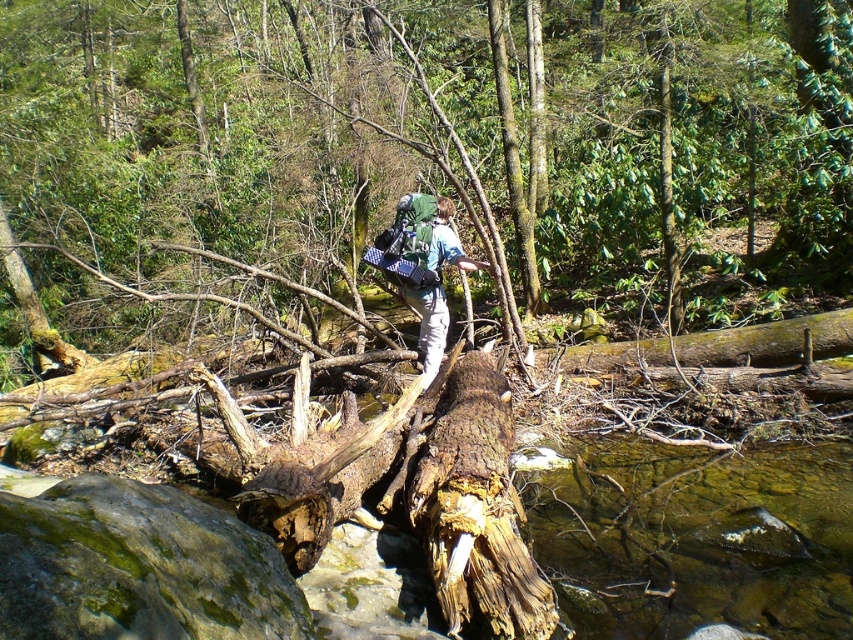
Based on the photo, does rough bark log at center have a smaller size compared to matte blue shirt at center?

No, rough bark log at center is not smaller than matte blue shirt at center.

Can you confirm if rough bark log at center is positioned above matte blue shirt at center?

Yes.

Describe the element at coordinates (439, 136) in the screenshot. This screenshot has width=853, height=640. I see `rough bark log at center` at that location.

Identify the location of rough bark log at center. (439, 136).

In the scene shown: Measure the distance between point (479, 440) and camera.

Point (479, 440) and camera are 13.69 feet apart from each other.

Is rusty wood log at center thinner than matte blue shirt at center?

Yes.

Who is more forward, (418, 496) or (413, 294)?

Point (418, 496)

The width and height of the screenshot is (853, 640). What are the coordinates of `rusty wood log at center` in the screenshot? It's located at (476, 509).

Does rough bark log at center have a greater width compared to rusty wood log at center?

Correct, the width of rough bark log at center exceeds that of rusty wood log at center.

Who is more forward, (840, 244) or (467, 474)?

Positioned in front is point (467, 474).

Who is more distant from viewer, (x=569, y=156) or (x=431, y=428)?

Positioned behind is point (x=569, y=156).

Where is `rough bark log at center`? This screenshot has width=853, height=640. rough bark log at center is located at coordinates (439, 136).